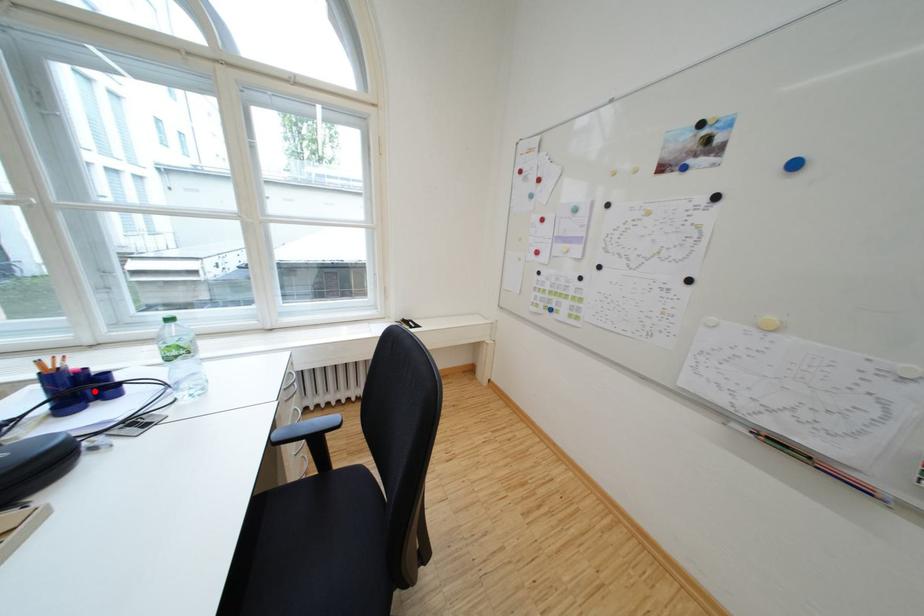
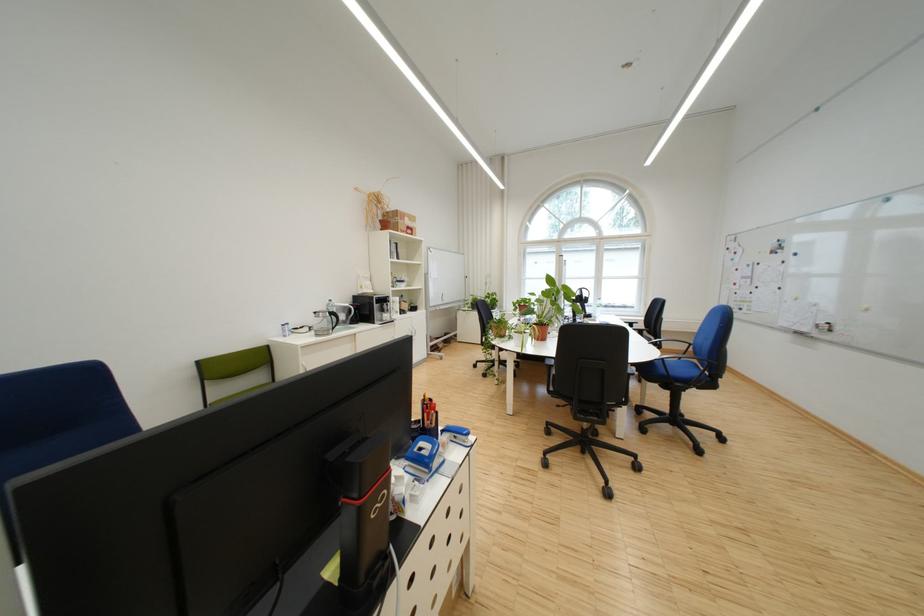
Question: I am providing you with two images of the same scene from different viewpoints. A red point is marked on the first image. At the location where the point appears in image 1, is it still visible in image 2?

Choices:
 (A) Yes
 (B) No

Answer: (B)